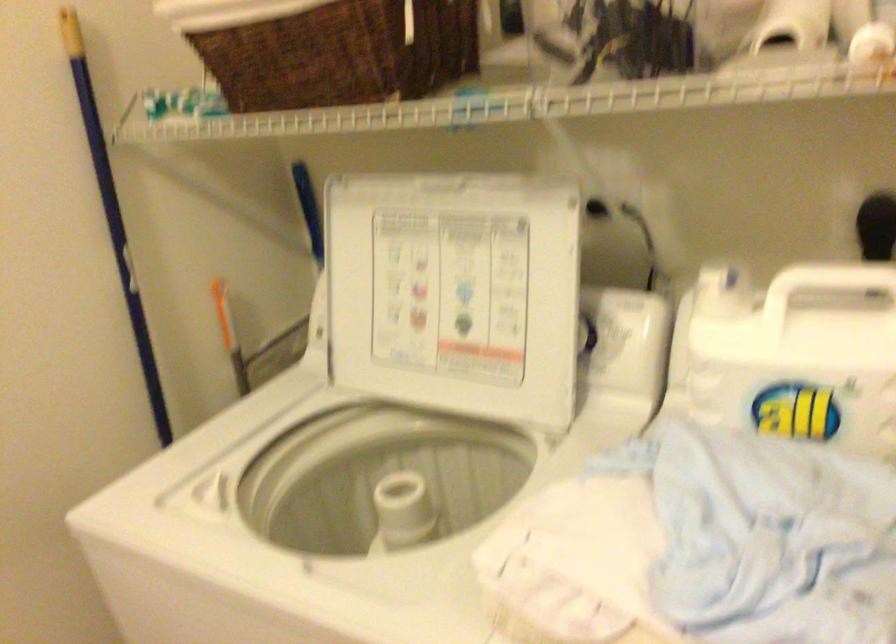
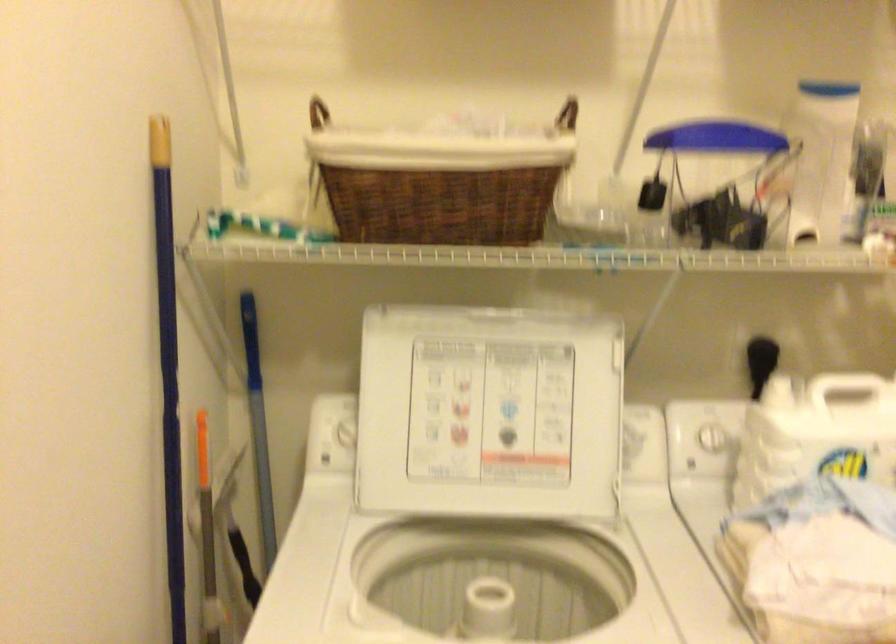
Where in the second image is the point corresponding to [445,294] from the first image?

(488, 413)